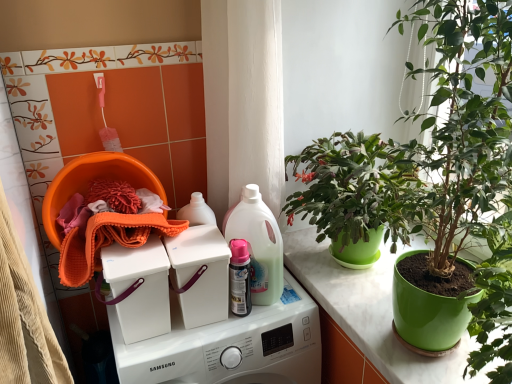
Question: From the image's perspective, is white plastic washing machine at center, which ranks as the second washing machine in bottom-to-top order, on top of pink glossy spray can at center?

Choices:
 (A) no
 (B) yes

Answer: (B)

Question: Can you confirm if white plastic washing machine at center, the first washing machine viewed from the top, is positioned to the left of pink glossy spray can at center?

Choices:
 (A) no
 (B) yes

Answer: (B)

Question: Does white plastic washing machine at center, which ranks as the second washing machine in bottom-to-top order, have a greater width compared to pink glossy spray can at center?

Choices:
 (A) yes
 (B) no

Answer: (A)

Question: Does white plastic washing machine at center, the first washing machine viewed from the top, have a greater height compared to pink glossy spray can at center?

Choices:
 (A) yes
 (B) no

Answer: (B)

Question: Can you confirm if white plastic washing machine at center, which ranks as the second washing machine in bottom-to-top order, is bigger than pink glossy spray can at center?

Choices:
 (A) no
 (B) yes

Answer: (B)

Question: Is white plastic washing machine at center, the first washing machine viewed from the top, oriented towards pink glossy spray can at center?

Choices:
 (A) yes
 (B) no

Answer: (B)

Question: Is translucent plastic spray bottle at center far away from green matte plant pot at center?

Choices:
 (A) yes
 (B) no

Answer: (B)

Question: Is translucent plastic spray bottle at center oriented away from green matte plant pot at center?

Choices:
 (A) no
 (B) yes

Answer: (A)

Question: Is translucent plastic spray bottle at center to the right of green matte plant pot at center from the viewer's perspective?

Choices:
 (A) yes
 (B) no

Answer: (B)

Question: Could you tell me if translucent plastic spray bottle at center is turned towards green matte plant pot at center?

Choices:
 (A) no
 (B) yes

Answer: (A)

Question: Does translucent plastic spray bottle at center have a lesser height compared to green matte plant pot at center?

Choices:
 (A) yes
 (B) no

Answer: (B)

Question: From the image's perspective, does translucent plastic spray bottle at center appear higher than green matte plant pot at center?

Choices:
 (A) yes
 (B) no

Answer: (A)

Question: Can you confirm if translucent plastic spray bottle at center is thinner than orange microfiber cloth at left?

Choices:
 (A) yes
 (B) no

Answer: (A)